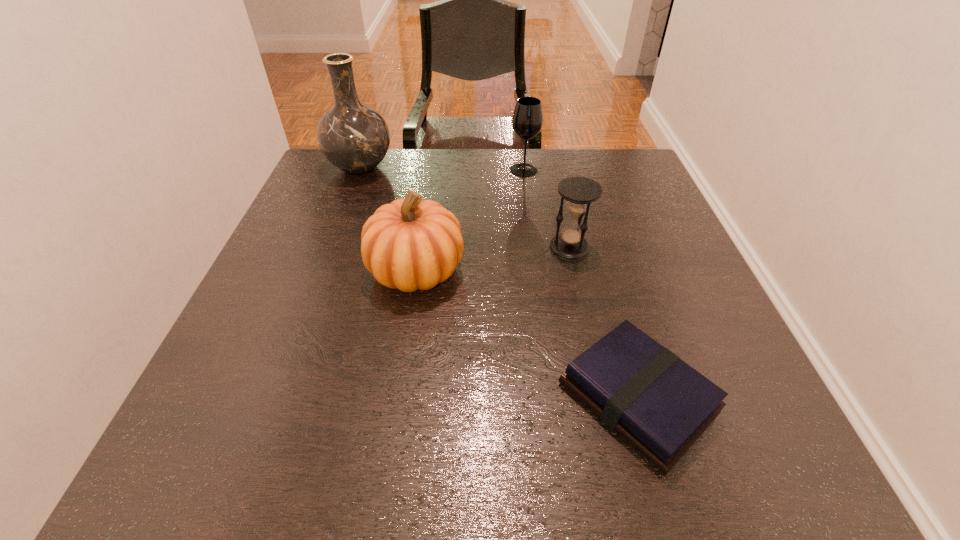
Image resolution: width=960 pixels, height=540 pixels. In the image, there is a desktop. What are the coordinates of `vacant space at the near edge` in the screenshot? It's located at pos(409,447).

I want to click on vacant space at the left edge, so click(x=307, y=325).

At what (x,y) coordinates should I click in order to perform the action: click on vacant space at the right edge of the desktop. Please return your answer as a coordinate pair (x, y). This screenshot has width=960, height=540. Looking at the image, I should click on (650, 226).

You are a GUI agent. You are given a task and a screenshot of the screen. Output one action in this format:
    pyautogui.click(x=<x>, y=<y>)
    Task: Click on the free spot at the far left corner of the desktop
    This screenshot has height=540, width=960.
    Given the screenshot: What is the action you would take?
    pyautogui.click(x=321, y=176)

You are a GUI agent. You are given a task and a screenshot of the screen. Output one action in this format:
    pyautogui.click(x=<x>, y=<y>)
    Task: Click on the free region at the far right corner of the desktop
    The image size is (960, 540).
    Given the screenshot: What is the action you would take?
    pyautogui.click(x=592, y=160)

Locate an element on the screen. free area in between the leftmost object and the wineglass is located at coordinates (443, 169).

Find the location of a particular element. The width and height of the screenshot is (960, 540). free space between the book and the leftmost object is located at coordinates (499, 283).

In order to click on vacant space in between the leftmost object and the hourglass in this screenshot , I will do `click(465, 208)`.

Locate an element on the screen. This screenshot has width=960, height=540. vacant point located between the wineglass and the nearest object is located at coordinates (581, 284).

The width and height of the screenshot is (960, 540). Find the location of `empty space between the shortest object and the hourglass`. empty space between the shortest object and the hourglass is located at coordinates (604, 323).